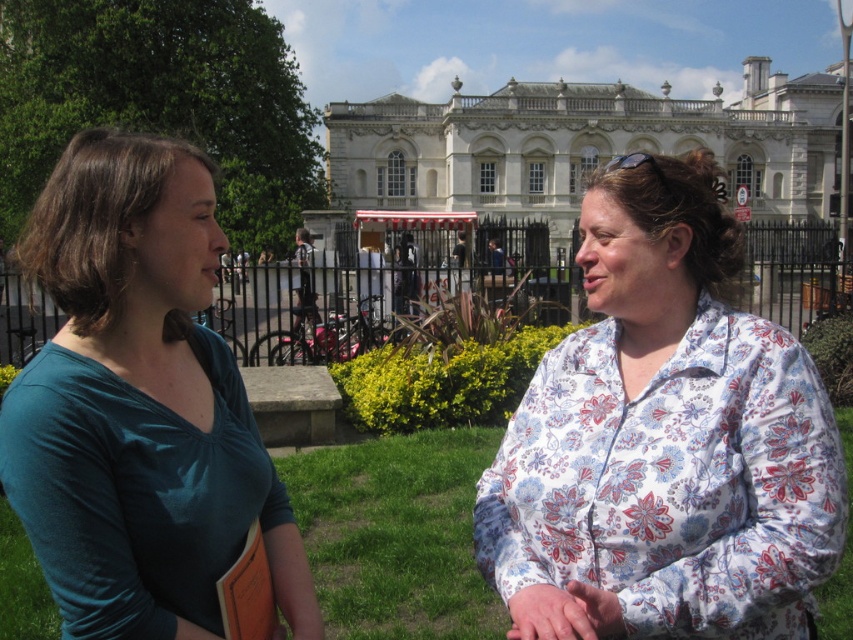
Which of these two, teal fabric shirt at left or white glossy building at center, stands taller?

Standing taller between the two is teal fabric shirt at left.

Is teal fabric shirt at left below white glossy building at center?

Yes.

The height and width of the screenshot is (640, 853). What do you see at coordinates (138, 404) in the screenshot? I see `teal fabric shirt at left` at bounding box center [138, 404].

Locate an element on the screen. This screenshot has width=853, height=640. teal fabric shirt at left is located at coordinates (138, 404).

Is floral cotton shirt at center below white glossy building at center?

Yes, floral cotton shirt at center is below white glossy building at center.

Looking at this image, can you confirm if floral cotton shirt at center is shorter than white glossy building at center?

Indeed, floral cotton shirt at center has a lesser height compared to white glossy building at center.

Does point (579, 604) come behind point (572, 180)?

No, (579, 604) is in front of (572, 180).

Find the location of a particular element. This screenshot has height=640, width=853. floral cotton shirt at center is located at coordinates (664, 440).

Is floral cotton shirt at center wider than teal fabric shirt at left?

Incorrect, floral cotton shirt at center's width does not surpass teal fabric shirt at left's.

Is point (607, 262) positioned behind point (120, 289)?

Yes, it is.

This screenshot has width=853, height=640. What do you see at coordinates (664, 440) in the screenshot?
I see `floral cotton shirt at center` at bounding box center [664, 440].

Identify the location of floral cotton shirt at center. (664, 440).